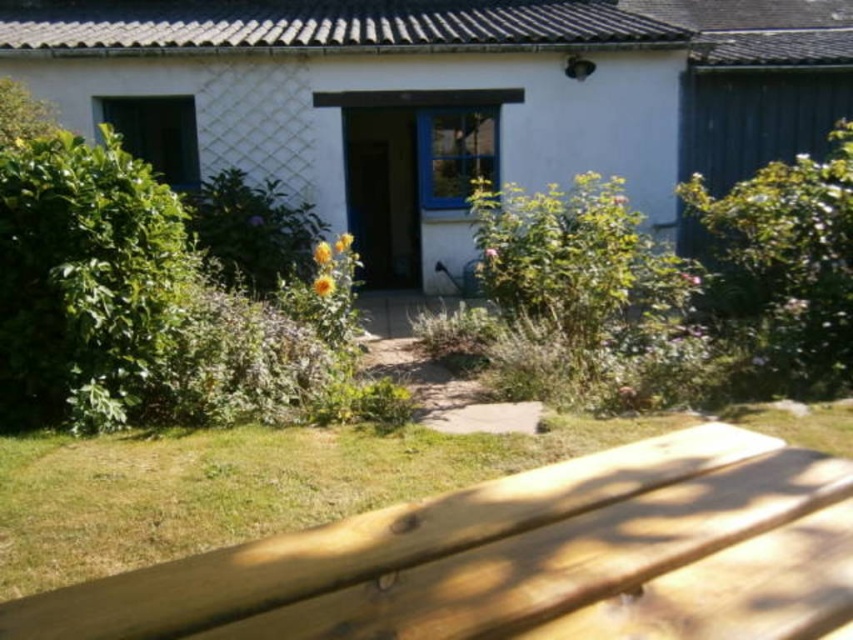
Image resolution: width=853 pixels, height=640 pixels. Describe the element at coordinates (370, 102) in the screenshot. I see `white painted wood cottage at center` at that location.

Image resolution: width=853 pixels, height=640 pixels. I want to click on white painted wood cottage at center, so click(x=370, y=102).